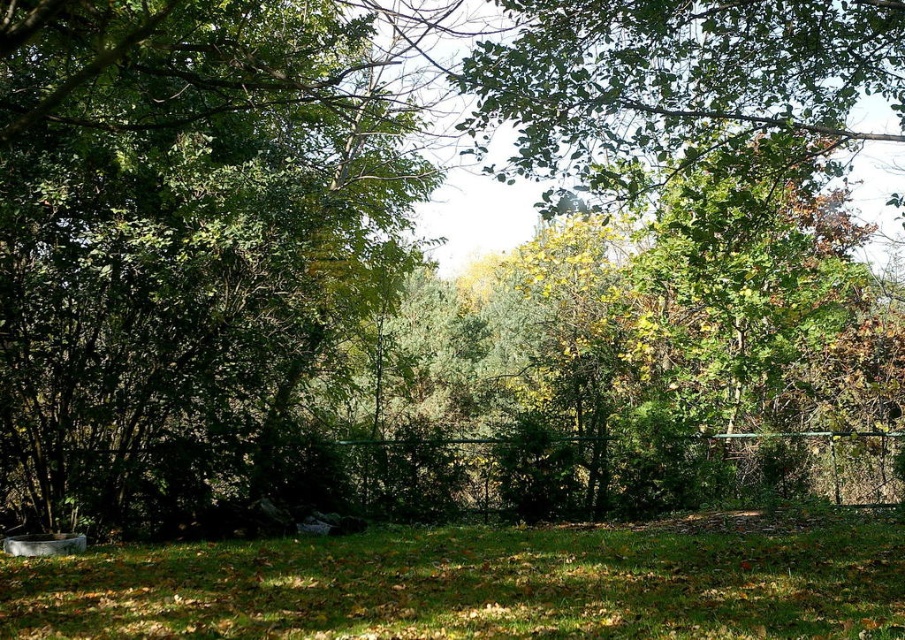
Question: Which point is farther to the camera?

Choices:
 (A) green metal fence at center
 (B) green grassy at lower center

Answer: (A)

Question: Which point is closer to the camera?

Choices:
 (A) green metal fence at center
 (B) green grassy at lower center

Answer: (B)

Question: Observing the image, what is the correct spatial positioning of green grassy at lower center in reference to green metal fence at center?

Choices:
 (A) below
 (B) above

Answer: (A)

Question: Considering the relative positions of green grassy at lower center and green metal fence at center in the image provided, where is green grassy at lower center located with respect to green metal fence at center?

Choices:
 (A) below
 (B) above

Answer: (A)

Question: Among these points, which one is nearest to the camera?

Choices:
 (A) (706, 600)
 (B) (807, 436)

Answer: (A)

Question: From the image, what is the correct spatial relationship of green grassy at lower center in relation to green metal fence at center?

Choices:
 (A) left
 (B) right

Answer: (A)